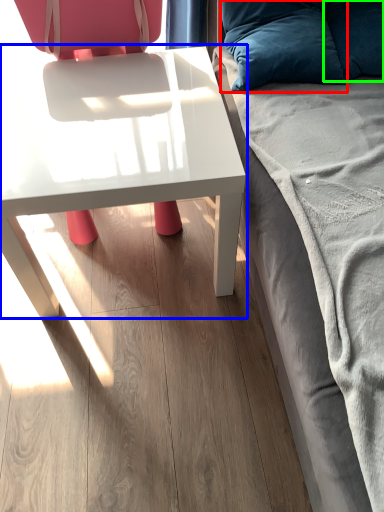
Question: Based on their relative distances, which object is nearer to pillow (highlighted by a red box)? Choose from table (highlighted by a blue box) and pillow (highlighted by a green box).

Choices:
 (A) table
 (B) pillow

Answer: (B)